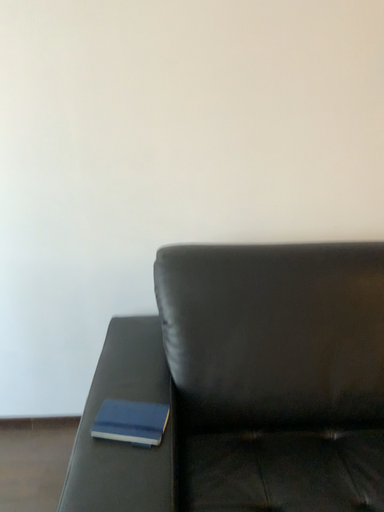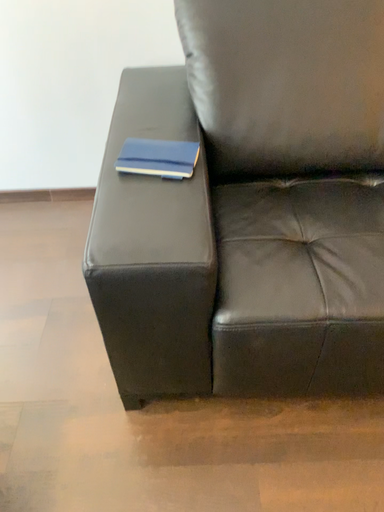
Question: Which way did the camera rotate in the video?

Choices:
 (A) rotated upward
 (B) rotated downward

Answer: (B)